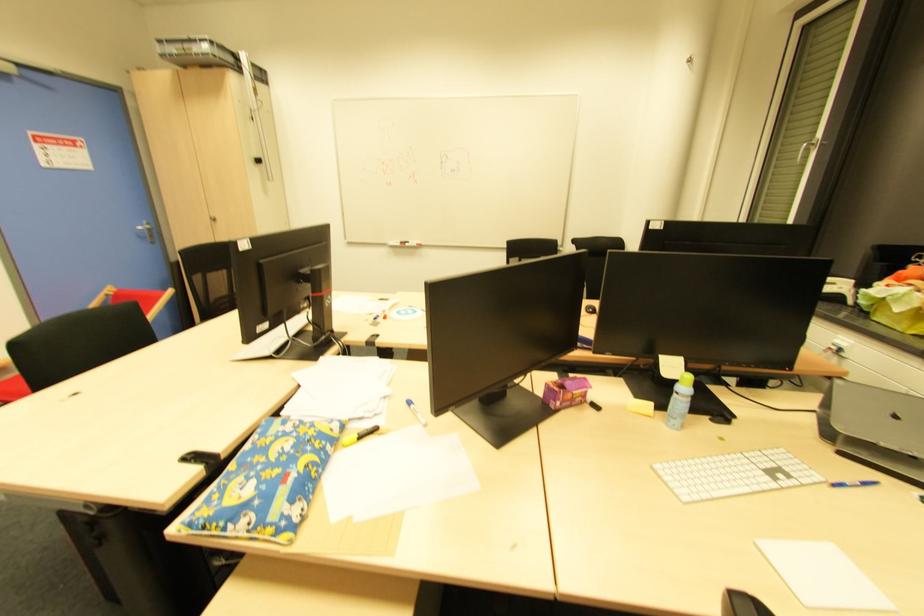
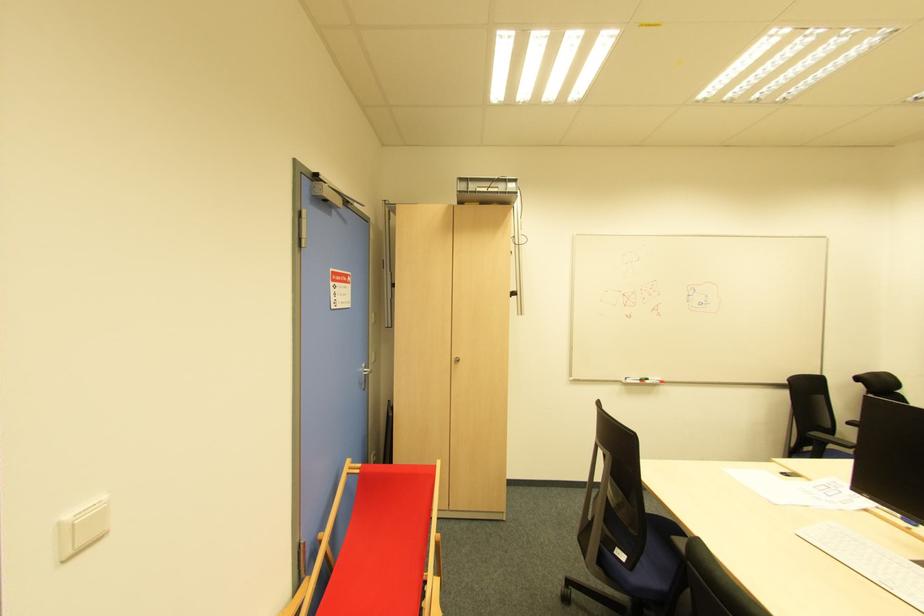
The point at (x=215, y=222) is marked in the first image. Where is the corresponding point in the second image?

(457, 362)